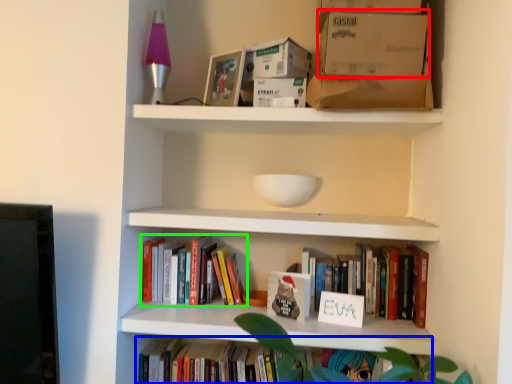
Question: Estimate the real-world distances between objects in this image. Which object is closer to cardboard box (highlighted by a red box), book (highlighted by a blue box) or book (highlighted by a green box)?

Choices:
 (A) book
 (B) book

Answer: (B)